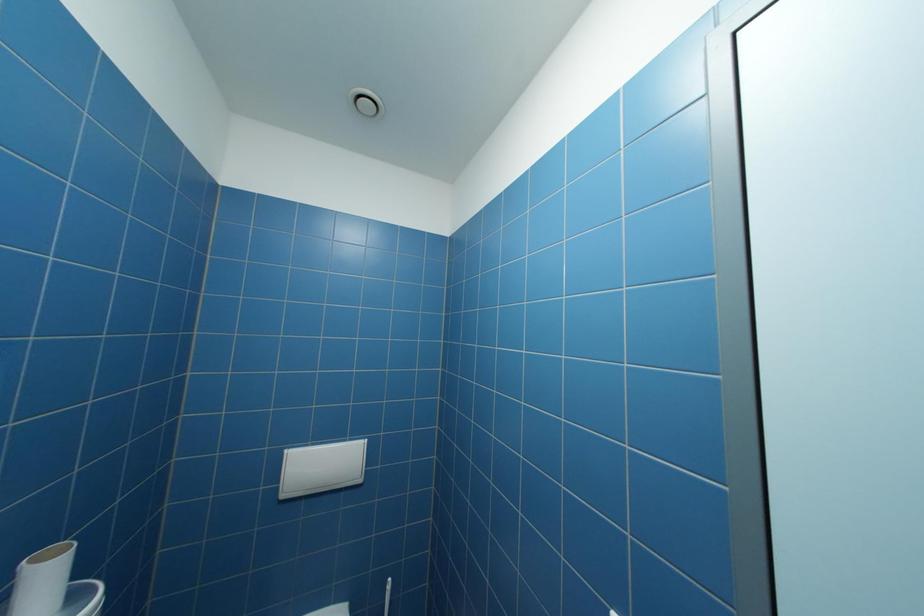
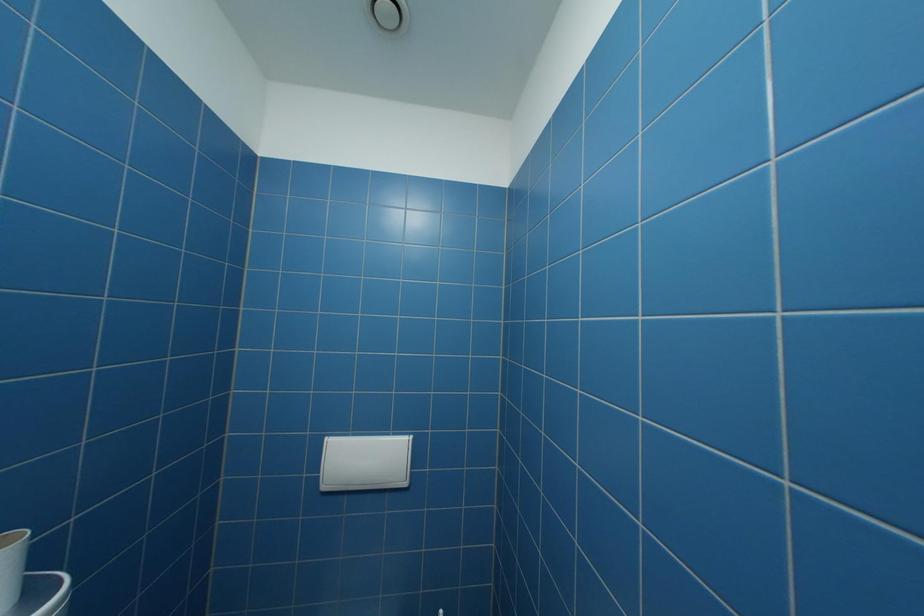
Question: The images are taken continuously from a first-person perspective. In which direction are you moving?

Choices:
 (A) Left
 (B) Right
 (C) Forward
 (D) Backward

Answer: (C)